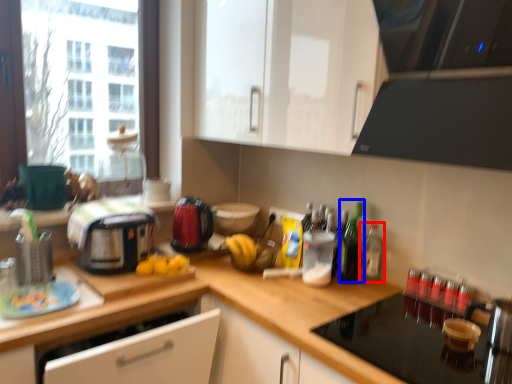
Question: Which object appears closest to the camera in this image, bottle (highlighted by a red box) or bottle (highlighted by a blue box)?

Choices:
 (A) bottle
 (B) bottle

Answer: (B)